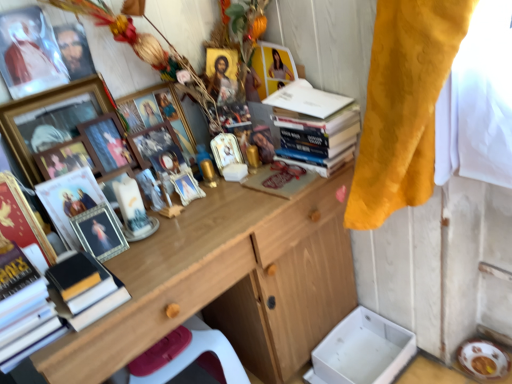
Locate an element on the screen. free space that is to the left of matte brown book at center, arranged as the first magazine when viewed from the right is located at coordinates (228, 200).